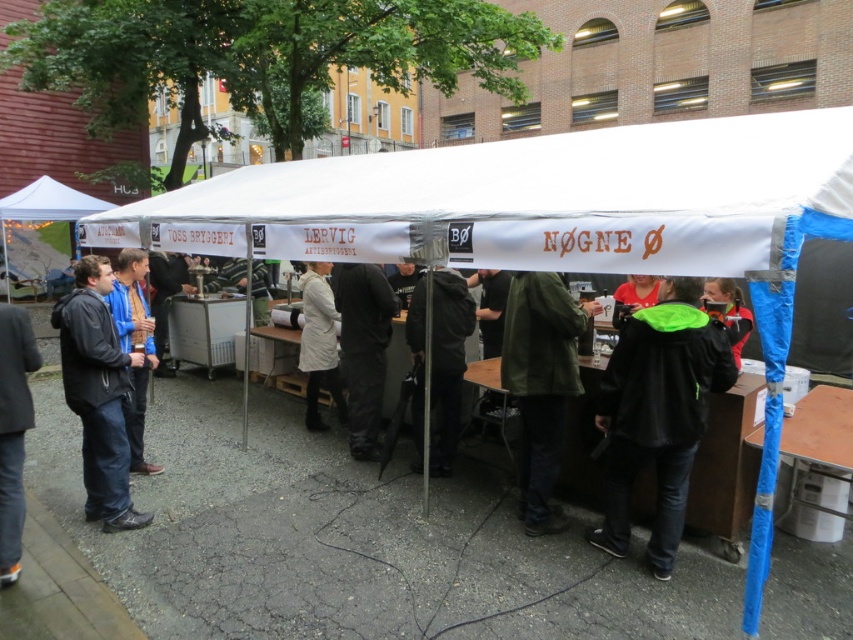
You are a photographer at the event and want to take a photo of the black matte jacket at lower right without the white fabric canopy at center blocking the view. Is this possible?

The black matte jacket at lower right is behind the white fabric canopy at center, so it is already hidden from view. Therefore, you cannot take a photo of the black matte jacket at lower right without the white fabric canopy at center blocking the view.

From the picture: You are at the event and need to find someone wearing a jacket. You see both the black matte jacket at lower right and the red jacket at lower right. Which jacket is bigger?

The black matte jacket at lower right is larger in size compared to the red jacket at lower right.